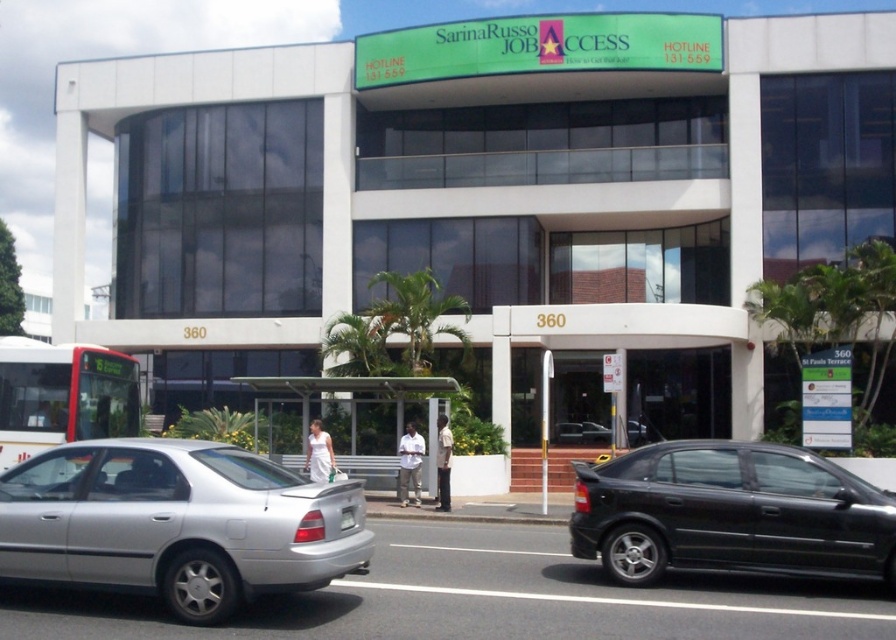
Is black glossy sedan at lower right above white matte bus at left?

Actually, black glossy sedan at lower right is below white matte bus at left.

Is point (696, 499) less distant than point (6, 371)?

Yes, point (696, 499) is closer to viewer.

Where is `black glossy sedan at lower right`? black glossy sedan at lower right is located at coordinates (730, 513).

Who is more forward, [254,525] or [642,509]?

Point [254,525]

Is silver metallic sedan at lower left positioned at the back of black glossy sedan at lower right?

That is False.

Between point (140, 589) and point (651, 525), which one is positioned behind?

The point (651, 525) is behind.

Where is `silver metallic sedan at lower left`? The width and height of the screenshot is (896, 640). silver metallic sedan at lower left is located at coordinates (177, 524).

Which is in front, point (225, 464) or point (126, 404)?

Positioned in front is point (225, 464).

Is silver metallic sedan at lower left to the right of white matte bus at left from the viewer's perspective?

Indeed, silver metallic sedan at lower left is positioned on the right side of white matte bus at left.

Find the location of `silver metallic sedan at lower left`. silver metallic sedan at lower left is located at coordinates (177, 524).